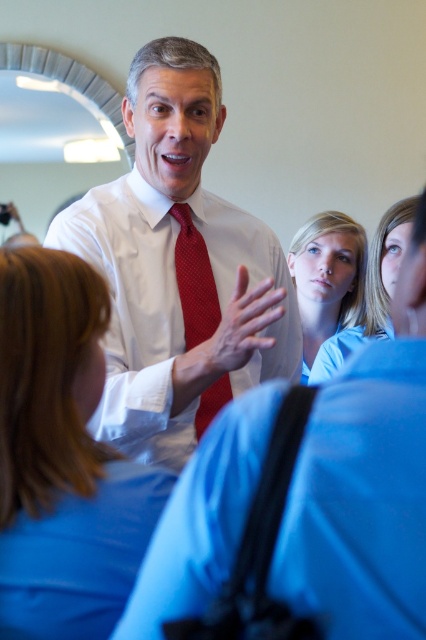
Who is higher up, blue fabric shirt at center or blonde hair at center?

blonde hair at center is higher up.

Between blue fabric shirt at center and blonde hair at center, which one is positioned lower?

Positioned lower is blue fabric shirt at center.

Is point (399, 548) positioned after point (92, 538)?

No, it is in front of (92, 538).

Find the location of a particular element. blue fabric shirt at center is located at coordinates (360, 500).

Find the location of a particular element. The height and width of the screenshot is (640, 426). blue fabric shirt at center is located at coordinates (360, 500).

Can you confirm if blue fabric shirt at center is taller than smooth blue shirt at center?

No, blue fabric shirt at center is not taller than smooth blue shirt at center.

Which is behind, point (299, 544) or point (305, 362)?

Point (305, 362)

Locate an element on the screen. The height and width of the screenshot is (640, 426). blue fabric shirt at center is located at coordinates (360, 500).

Between blonde hair at center and smooth red tie at center, which one has more height?

Standing taller between the two is blonde hair at center.

Is blonde hair at center to the left of smooth red tie at center from the viewer's perspective?

Yes, blonde hair at center is to the left of smooth red tie at center.

Describe the element at coordinates (62, 460) in the screenshot. I see `blonde hair at center` at that location.

Locate an element on the screen. Image resolution: width=426 pixels, height=640 pixels. blonde hair at center is located at coordinates (62, 460).